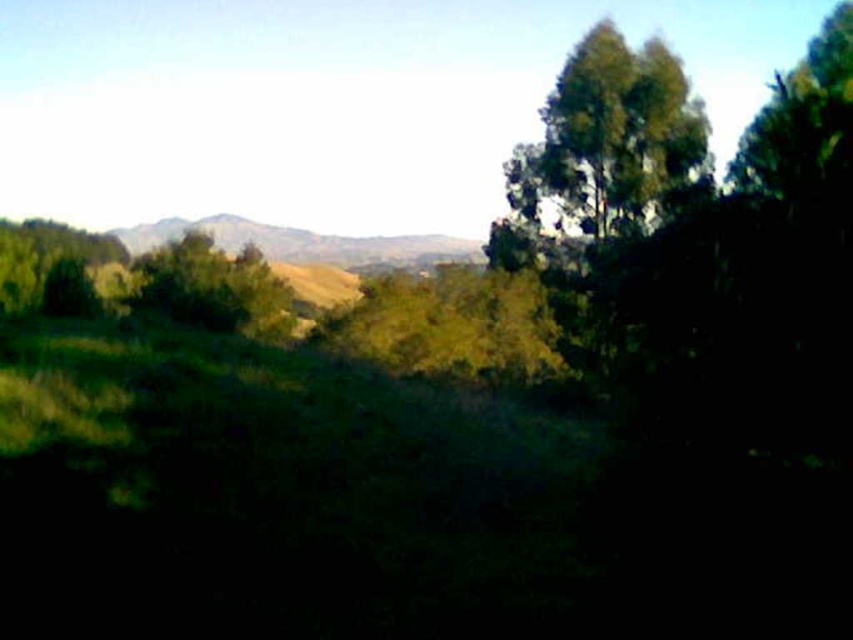
Does green leafy tree at upper right have a larger size compared to rugged brown mountain at center?

No.

Which is behind, point (525, 221) or point (120, 240)?

Point (120, 240)

I want to click on green leafy tree at upper right, so click(601, 148).